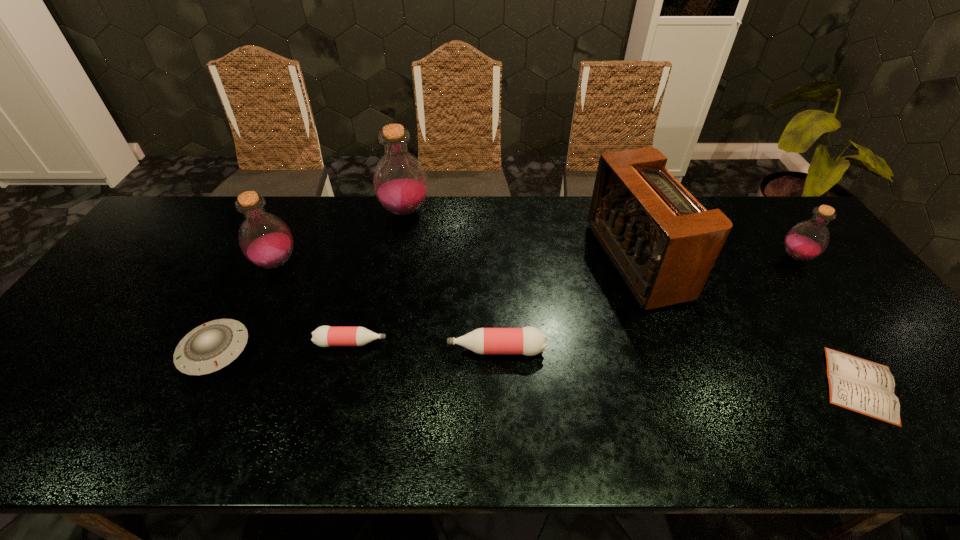
I want to click on the farthest purple bottle, so click(x=400, y=182).

This screenshot has height=540, width=960. Identify the location of the second purple bottle from left to right. (400, 182).

This screenshot has width=960, height=540. I want to click on the sixth object from left to right, so click(663, 242).

Image resolution: width=960 pixels, height=540 pixels. I want to click on the fourth shortest bottle, so click(265, 239).

Where is `the leftmost purple bottle`? The image size is (960, 540). the leftmost purple bottle is located at coordinates (265, 239).

Find the location of a particular element. The image size is (960, 540). the fifth shortest object is located at coordinates (808, 239).

Identify the location of the rightmost purple bottle. The width and height of the screenshot is (960, 540). [808, 239].

Locate an element on the screen. This screenshot has width=960, height=540. the bigger pink bottle is located at coordinates (529, 341).

You are a GUI agent. You are given a task and a screenshot of the screen. Output one action in this format:
    pyautogui.click(x=<x>, y=<y>)
    Task: Click on the second shortest bottle
    This screenshot has height=540, width=960.
    Given the screenshot: What is the action you would take?
    pyautogui.click(x=529, y=341)

Identify the location of the left pink bottle. (324, 336).